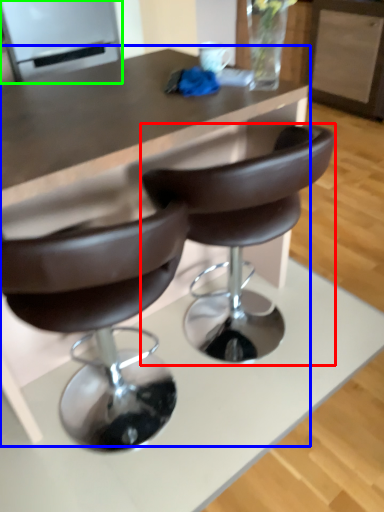
Question: Based on their relative distances, which object is nearer to chair (highlighted by a red box)? Choose from table (highlighted by a blue box) and appliance (highlighted by a green box).

Choices:
 (A) table
 (B) appliance

Answer: (A)